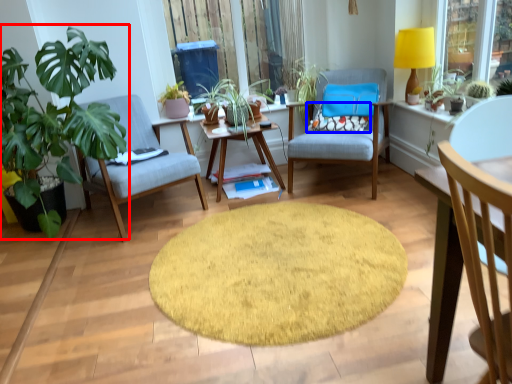
Question: Which object is closer to the camera taking this photo, houseplant (highlighted by a red box) or pillow (highlighted by a blue box)?

Choices:
 (A) houseplant
 (B) pillow

Answer: (A)